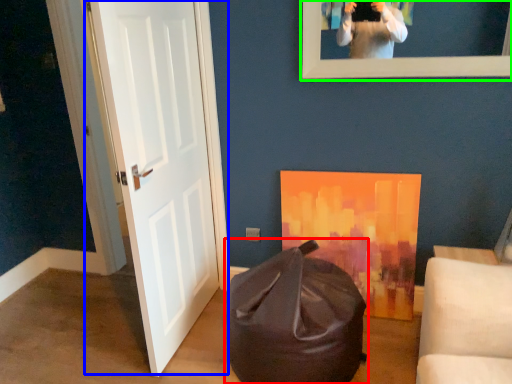
Question: Considering the real-world distances, which object is closest to bean bag chair (highlighted by a red box)? door (highlighted by a blue box) or picture frame (highlighted by a green box).

Choices:
 (A) door
 (B) picture frame

Answer: (A)